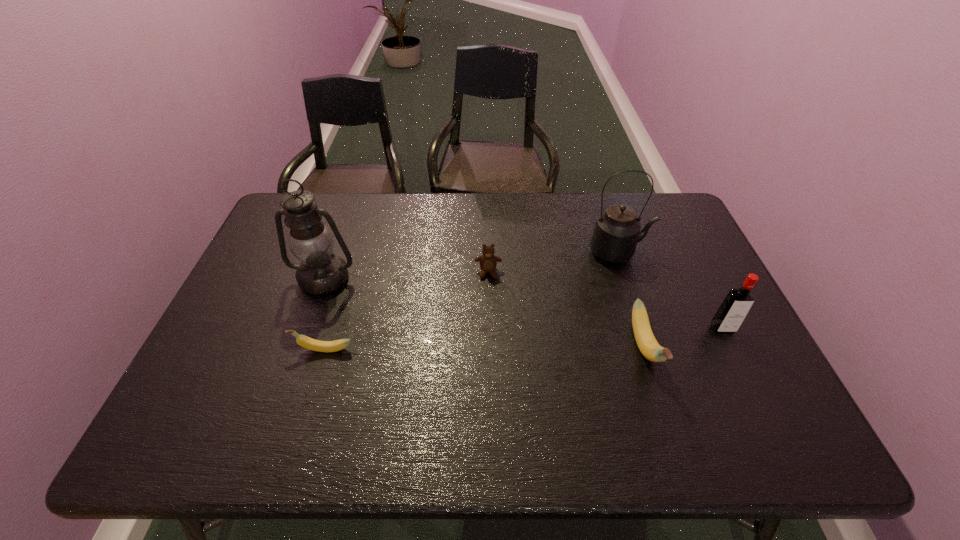
Locate an element on the screen. This screenshot has width=960, height=540. the left banana is located at coordinates (304, 341).

Find the location of a particular element. The width and height of the screenshot is (960, 540). the shorter banana is located at coordinates (304, 341).

You are a GUI agent. You are given a task and a screenshot of the screen. Output one action in this format:
    pyautogui.click(x=<x>, y=<y>)
    Task: Click on the right banana
    The height and width of the screenshot is (540, 960).
    Given the screenshot: What is the action you would take?
    pyautogui.click(x=649, y=347)

Locate an element on the screen. The height and width of the screenshot is (540, 960). oil lamp is located at coordinates (321, 272).

Locate an element on the screen. The height and width of the screenshot is (540, 960). the second tallest object is located at coordinates (617, 231).

Locate an element on the screen. The width and height of the screenshot is (960, 540). the fourth shortest object is located at coordinates (733, 310).

Find the location of `the rightmost object`. the rightmost object is located at coordinates (733, 310).

I want to click on the fifth tallest object, so click(x=488, y=261).

Image resolution: width=960 pixels, height=540 pixels. Identify the location of the fourth object from right to left. 488,261.

Find the location of a particular element. vacant area situated at the stem of the left banana is located at coordinates (234, 349).